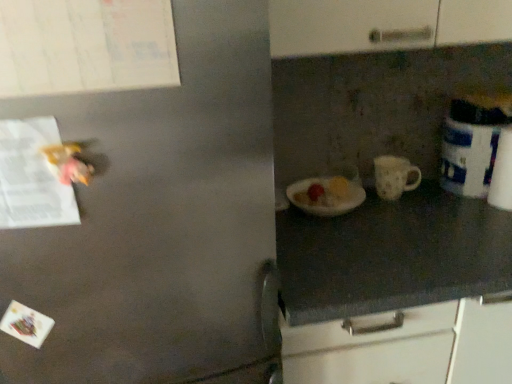
Question: Is white glossy canister at right facing towards white matte mug at center?

Choices:
 (A) yes
 (B) no

Answer: (B)

Question: Is white glossy canister at right smaller than white matte mug at center?

Choices:
 (A) no
 (B) yes

Answer: (A)

Question: From the image's perspective, is white glossy canister at right on top of white matte mug at center?

Choices:
 (A) yes
 (B) no

Answer: (A)

Question: Considering the relative sizes of white glossy canister at right and white matte mug at center in the image provided, is white glossy canister at right taller than white matte mug at center?

Choices:
 (A) yes
 (B) no

Answer: (A)

Question: Could white matte mug at center be considered to be inside white glossy canister at right?

Choices:
 (A) yes
 (B) no

Answer: (B)

Question: From the image's perspective, is white glossy canister at right located beneath white matte mug at center?

Choices:
 (A) yes
 (B) no

Answer: (B)

Question: Is white matte mug at center positioned behind white paper at left?

Choices:
 (A) no
 (B) yes

Answer: (B)

Question: Can you confirm if white matte mug at center is wider than white paper at left?

Choices:
 (A) no
 (B) yes

Answer: (B)

Question: Is white matte mug at center oriented away from white paper at left?

Choices:
 (A) yes
 (B) no

Answer: (B)

Question: Is white matte mug at center not inside white paper at left?

Choices:
 (A) yes
 (B) no

Answer: (A)

Question: Is white matte mug at center to the left of white paper at left from the viewer's perspective?

Choices:
 (A) no
 (B) yes

Answer: (A)

Question: Can you confirm if white matte mug at center is taller than white paper at left?

Choices:
 (A) yes
 (B) no

Answer: (B)

Question: Is white glossy canister at right aimed at white paper at left?

Choices:
 (A) yes
 (B) no

Answer: (B)